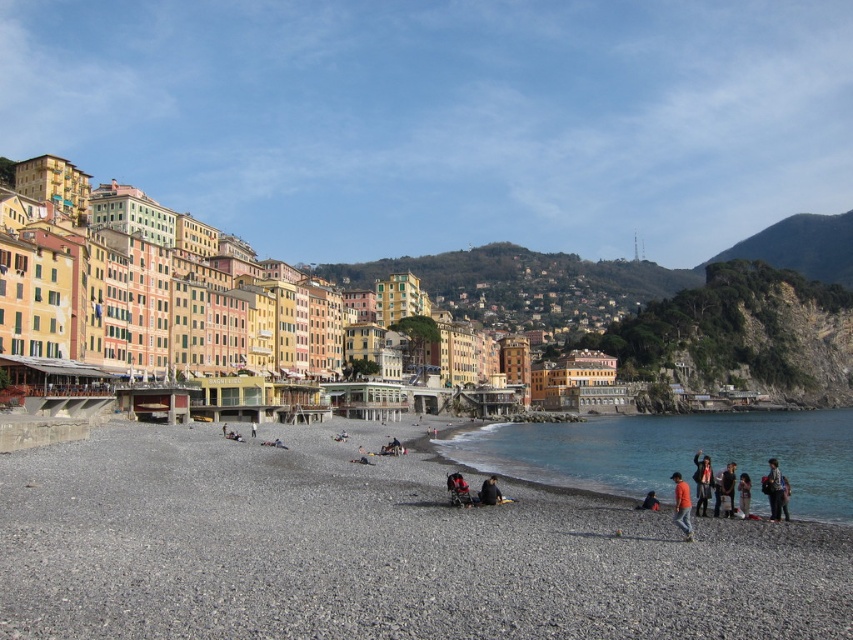
Consider the image. You are a photographer standing on the pebble beach and want to take a photo of the blue denim jeans at lower right and the dark gray fabric jacket at lower center. Which object should you zoom in on to capture both in the frame without moving the camera?

You should zoom in on the dark gray fabric jacket at lower center because it is shorter than the blue denim jeans at lower right, allowing both to fit within the frame when zoomed appropriately.

In the scene shown: You are a photographer standing at the beach and want to take a photo that includes both the green leafy hillside at upper right and the dark gray fabric jacket at lower center. Which object should you adjust your camera focus to first to ensure both are in focus?

The green leafy hillside at upper right is further to the viewer than the dark gray fabric jacket at lower center, so you should focus on the green leafy hillside at upper right first to ensure both are in focus.